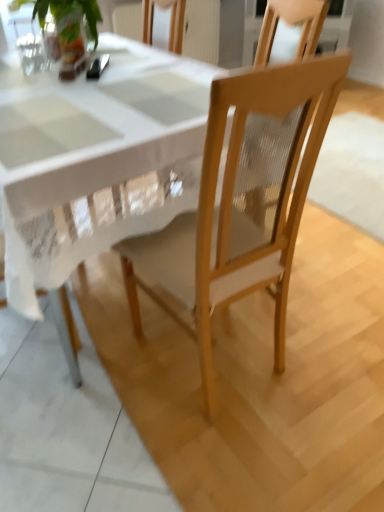
Question: Does light wood chair at center appear on the left side of green leafy plant at upper left?

Choices:
 (A) no
 (B) yes

Answer: (A)

Question: From the image's perspective, is light wood chair at center below green leafy plant at upper left?

Choices:
 (A) yes
 (B) no

Answer: (A)

Question: Is light wood chair at center positioned before green leafy plant at upper left?

Choices:
 (A) yes
 (B) no

Answer: (A)

Question: From a real-world perspective, is light wood chair at center physically above green leafy plant at upper left?

Choices:
 (A) no
 (B) yes

Answer: (A)

Question: From a real-world perspective, is light wood chair at center physically below green leafy plant at upper left?

Choices:
 (A) yes
 (B) no

Answer: (A)

Question: Considering the relative sizes of light wood chair at center and green leafy plant at upper left in the image provided, is light wood chair at center thinner than green leafy plant at upper left?

Choices:
 (A) no
 (B) yes

Answer: (A)

Question: From a real-world perspective, is light wood chair at center over metallic silver spoon at upper left?

Choices:
 (A) no
 (B) yes

Answer: (A)

Question: Is light wood chair at center taller than metallic silver spoon at upper left?

Choices:
 (A) yes
 (B) no

Answer: (A)

Question: From the image's perspective, would you say light wood chair at center is positioned over metallic silver spoon at upper left?

Choices:
 (A) no
 (B) yes

Answer: (A)

Question: Is light wood chair at center positioned with its back to metallic silver spoon at upper left?

Choices:
 (A) yes
 (B) no

Answer: (B)

Question: Is light wood chair at center outside of metallic silver spoon at upper left?

Choices:
 (A) no
 (B) yes

Answer: (B)

Question: From a real-world perspective, is light wood chair at center beneath metallic silver spoon at upper left?

Choices:
 (A) yes
 (B) no

Answer: (A)

Question: Is green leafy plant at upper left positioned beyond the bounds of light wood chair at center?

Choices:
 (A) no
 (B) yes

Answer: (B)